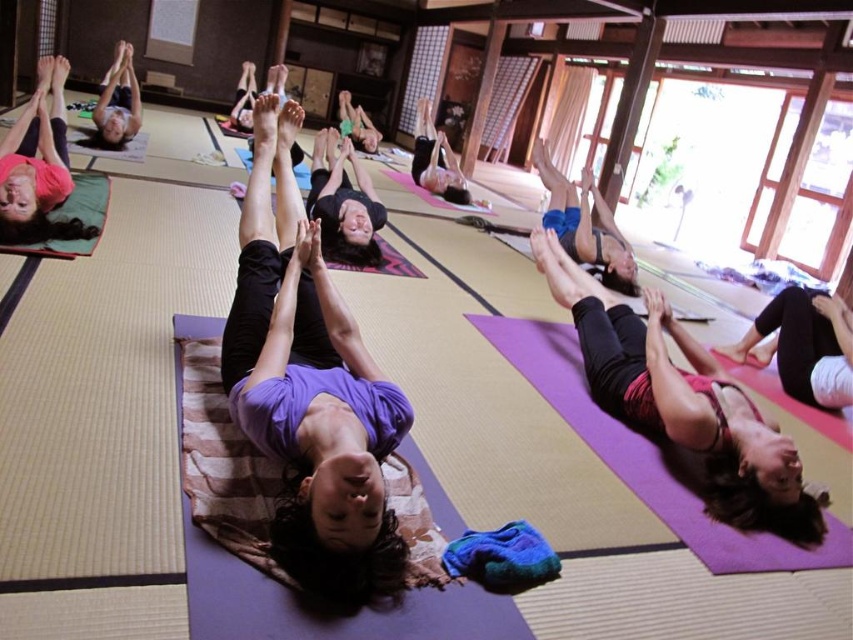
Can you confirm if matte green yoga mat at lower left is smaller than matte black yoga mat at upper left?

Yes, matte green yoga mat at lower left is smaller than matte black yoga mat at upper left.

What do you see at coordinates (38, 166) in the screenshot? Image resolution: width=853 pixels, height=640 pixels. I see `matte green yoga mat at lower left` at bounding box center [38, 166].

The height and width of the screenshot is (640, 853). I want to click on matte green yoga mat at lower left, so click(38, 166).

Is pink fabric yoga mat at lower right below black matte yoga mat at center?

Correct, pink fabric yoga mat at lower right is located below black matte yoga mat at center.

Measure the distance between pink fabric yoga mat at lower right and camera.

They are 2.15 meters apart.

Find the location of a particular element. This screenshot has width=853, height=640. pink fabric yoga mat at lower right is located at coordinates (683, 401).

Image resolution: width=853 pixels, height=640 pixels. Find the location of `pink fabric yoga mat at lower right`. pink fabric yoga mat at lower right is located at coordinates (683, 401).

Who is positioned more to the right, black matte yoga mat at lower right or black matte yoga mat at center?

From the viewer's perspective, black matte yoga mat at lower right appears more on the right side.

This screenshot has width=853, height=640. I want to click on black matte yoga mat at lower right, so click(x=804, y=346).

Locate an element on the screen. The image size is (853, 640). black matte yoga mat at lower right is located at coordinates (804, 346).